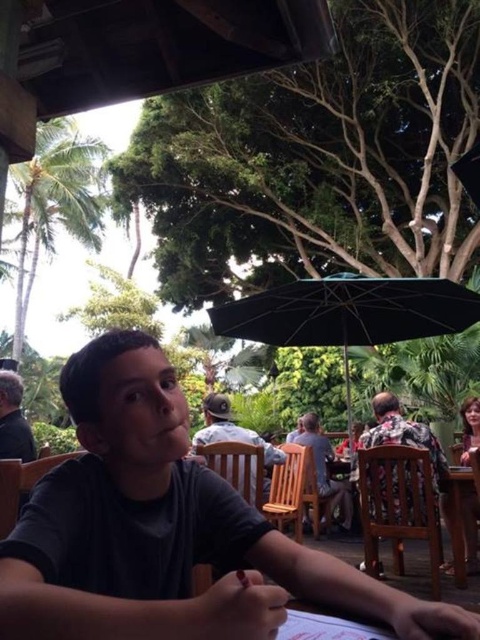
Question: Among these objects, which one is nearest to the camera?

Choices:
 (A) camouflage fabric shirt at center
 (B) black fabric umbrella at center
 (C) floral fabric shirt at center
 (D) black matte shirt at center

Answer: (D)

Question: Can you confirm if floral fabric shirt at center is wider than wooden table at lower right?

Choices:
 (A) yes
 (B) no

Answer: (A)

Question: Can you confirm if black matte shirt at center is positioned below black fabric umbrella at center?

Choices:
 (A) yes
 (B) no

Answer: (A)

Question: Considering the real-world distances, which object is farthest from the camouflage fabric shirt at center?

Choices:
 (A) wooden table at lower right
 (B) dark gray shirt at left
 (C) floral fabric shirt at center

Answer: (B)

Question: Which of the following is the farthest from the observer?

Choices:
 (A) floral fabric shirt at center
 (B) wooden table at lower right
 (C) dark gray shirt at left
 (D) black matte shirt at center

Answer: (A)

Question: Is black matte shirt at center positioned behind black fabric umbrella at center?

Choices:
 (A) no
 (B) yes

Answer: (A)